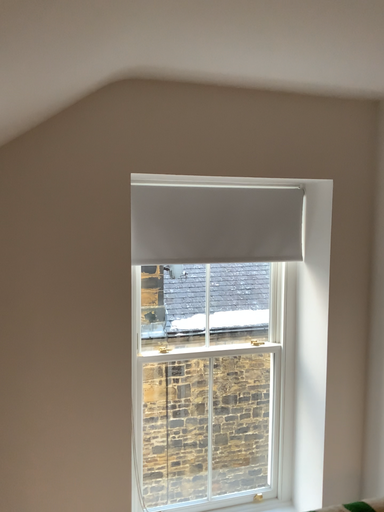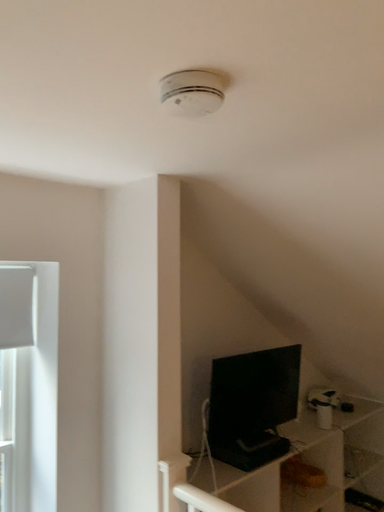
Question: How did the camera likely rotate when shooting the video?

Choices:
 (A) rotated right
 (B) rotated left

Answer: (A)